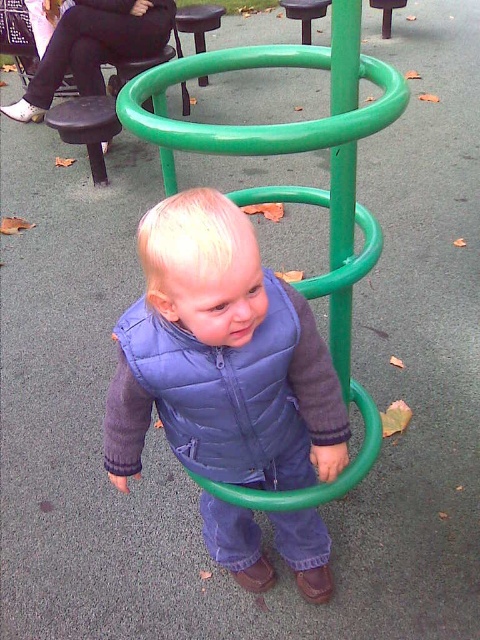
You are a photographer trying to capture a photo of the playground. You notice two points marked in the image. Which point is closer to you, point (96, 161) or point (179, 12)?

Point (96, 161) is closer to the viewer than point (179, 12).

You are a parent observing your child at the playground. You notice the blue quilted vest at center and the green rubber hula hoop at center. Which item is located above the other?

The blue quilted vest at center is positioned under the green rubber hula hoop at center, so the green rubber hula hoop at center is above the blue quilted vest at center.

In the scene shown: You are a parent supervising a child at the playground. You need to retrieve the green rubber hula hoop at center to give to another child sitting on the black plastic stool at upper center. Can you hand it directly without moving the stool?

The distance between the green rubber hula hoop at center and the black plastic stool at upper center is 10.36 feet. Since the stool is stationary, you would need to move towards the stool to hand it over, so you cannot do it directly without moving the stool.